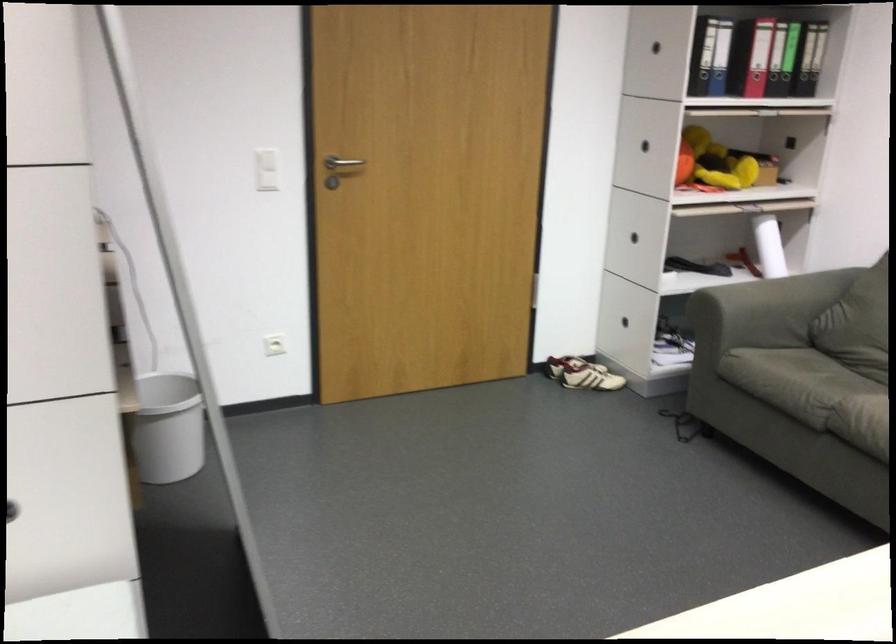
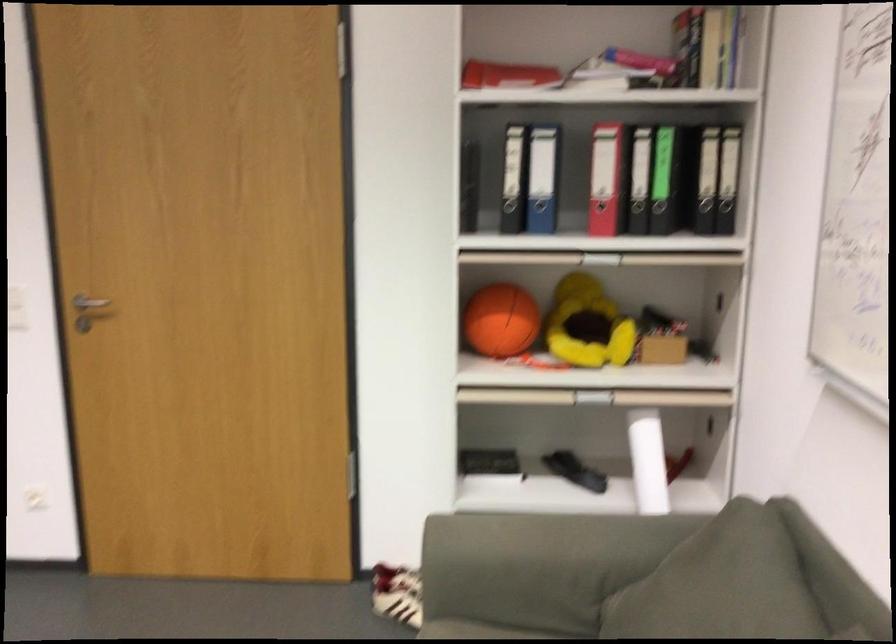
The point at (638, 263) is marked in the first image. Where is the corresponding point in the second image?

(489, 464)